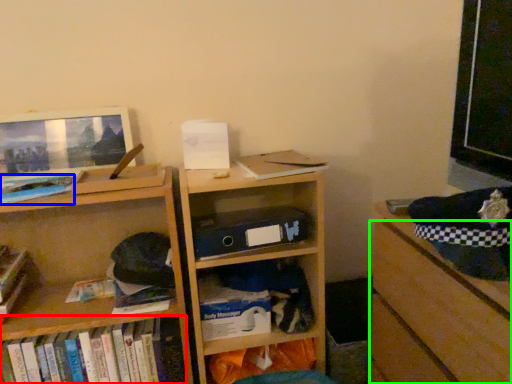
Question: Which is farther away from book (highlighted by a red box)? book (highlighted by a blue box) or drawer (highlighted by a green box)?

Choices:
 (A) book
 (B) drawer

Answer: (B)